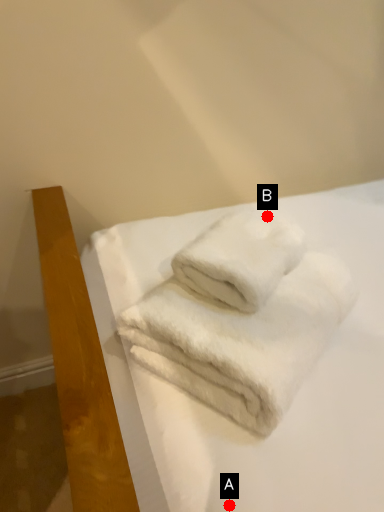
Question: Two points are circled on the image, labeled by A and B beside each circle. Which point is farther from the camera taking this photo?

Choices:
 (A) A is further
 (B) B is further

Answer: (B)